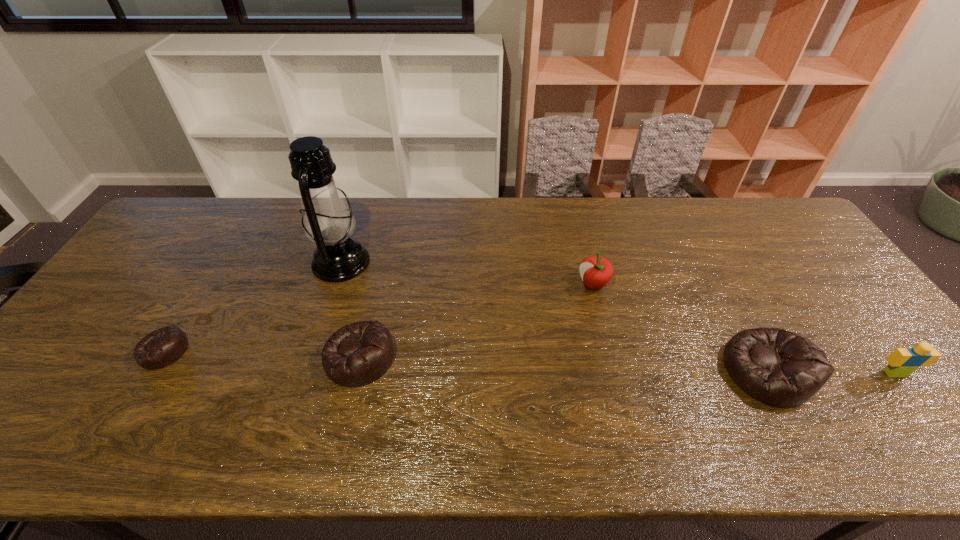
Where is `vacant area that lies between the leftmost beanbag and the second shortest beanbag`? Image resolution: width=960 pixels, height=540 pixels. vacant area that lies between the leftmost beanbag and the second shortest beanbag is located at coordinates (262, 354).

This screenshot has height=540, width=960. Identify the location of empty space between the oil lamp and the second object from right to left. (554, 317).

Find the location of a particular element. free spot between the third object from right to left and the oil lamp is located at coordinates (467, 274).

Find the location of a particular element. The width and height of the screenshot is (960, 540). vacant area between the second shortest object and the tallest object is located at coordinates (350, 310).

The image size is (960, 540). Identify the location of empty location between the apple and the rightmost beanbag. (680, 328).

Image resolution: width=960 pixels, height=540 pixels. What are the coordinates of `vacant area that lies between the third object from right to left and the rightmost beanbag` in the screenshot? It's located at (680, 328).

Find the location of a particular element. The image size is (960, 540). free area in between the apple and the shortest object is located at coordinates (378, 318).

At what (x,y) coordinates should I click in order to perform the action: click on vacant space that's between the rightmost beanbag and the oil lamp. Please return your answer as a coordinate pair (x, y). Looking at the image, I should click on (554, 317).

Choose which object is the fifth nearest neighbor to the tallest object. Please provide its 2D coordinates. Your answer should be formatted as a tuple, i.e. [(x, y)], where the tuple contains the x and y coordinates of a point satisfying the conditions above.

[(902, 362)]

Where is `object that is the fifth closest one to the fifth tallest object`? This screenshot has width=960, height=540. object that is the fifth closest one to the fifth tallest object is located at coordinates (902, 362).